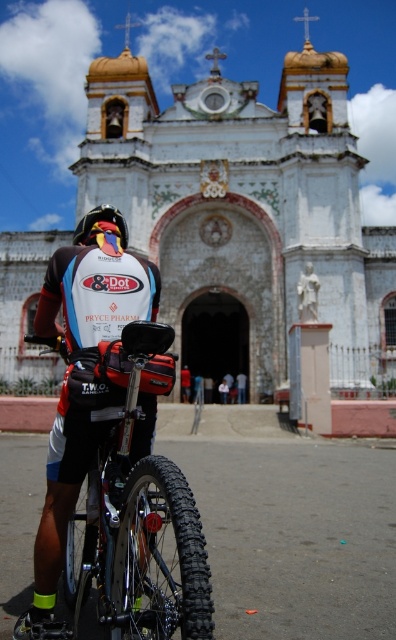
Question: Which point is farther from the camera taking this photo?

Choices:
 (A) (239, 392)
 (B) (186, 369)
 (C) (361, 445)
 (D) (39, 266)

Answer: (D)

Question: Which point is closer to the camera?

Choices:
 (A) (182, 387)
 (B) (365, 260)
 (C) (163, 604)

Answer: (C)

Question: Which point is closer to the camera?

Choices:
 (A) (218, 490)
 (B) (211, 275)

Answer: (A)

Question: Is black rubber tire at lower center to the right of multicolored plastic helmet at center from the viewer's perspective?

Choices:
 (A) no
 (B) yes

Answer: (B)

Question: Is multicolored plastic helmet at center smaller than dark blue fabric shirt at center?

Choices:
 (A) no
 (B) yes

Answer: (A)

Question: Where is multicolored plastic helmet at center located in relation to red fabric shorts at center in the image?

Choices:
 (A) below
 (B) above

Answer: (B)